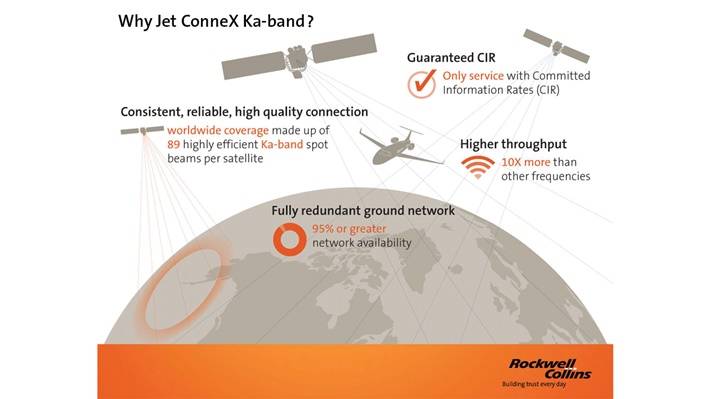
You are a GUI agent. You are given a task and a screenshot of the screen. Output one action in this format:
    pyautogui.click(x=<x>, y=<y>)
    Task: Click on the globe
    This screenshot has width=711, height=399.
    Given the screenshot: What is the action you would take?
    pyautogui.click(x=424, y=328)